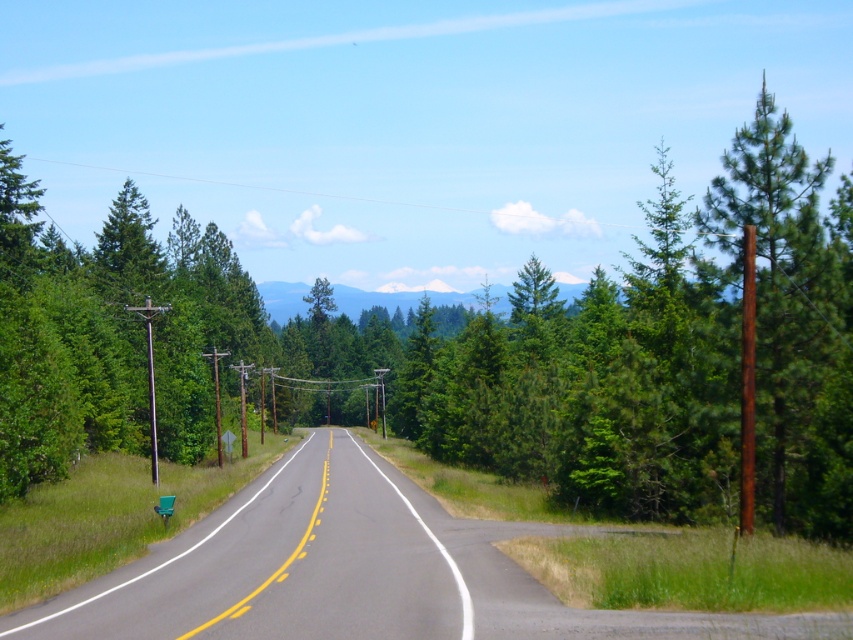
Question: Is asphalt road at center closer to camera compared to brown rough pole at right?

Choices:
 (A) no
 (B) yes

Answer: (B)

Question: Among these points, which one is farthest from the camera?

Choices:
 (A) (296, 582)
 (B) (815, 486)

Answer: (B)

Question: Can you confirm if asphalt road at center is positioned to the right of brown rough pole at right?

Choices:
 (A) yes
 (B) no

Answer: (B)

Question: Which of the following is the farthest from the observer?

Choices:
 (A) asphalt road at center
 (B) brown rough pole at right

Answer: (B)

Question: Is asphalt road at center below brown rough pole at right?

Choices:
 (A) no
 (B) yes

Answer: (B)

Question: Among these objects, which one is farthest from the camera?

Choices:
 (A) asphalt road at center
 (B) brown rough pole at right

Answer: (B)